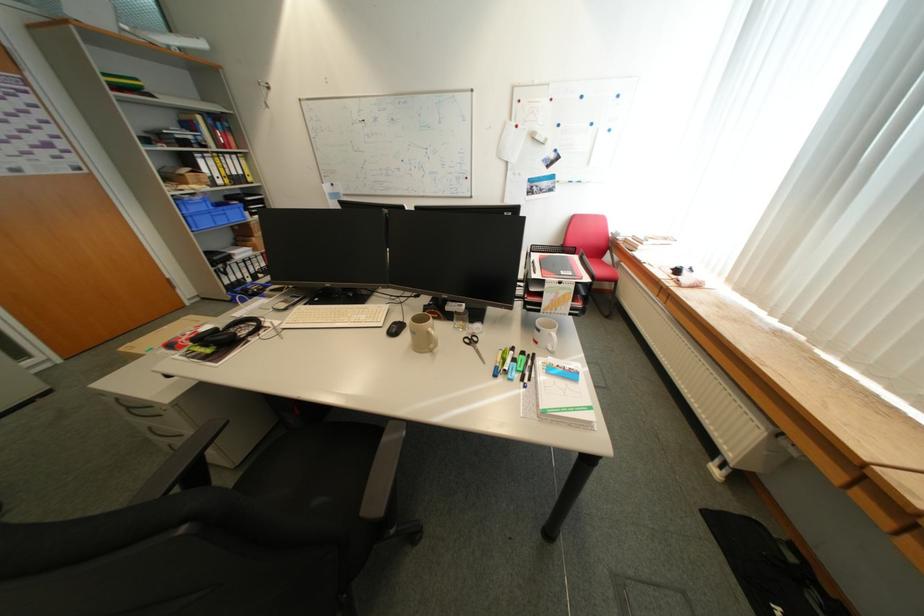
Where would you lift the blue marker? Please return your answer as a coordinate pair (x, y).

(529, 376)